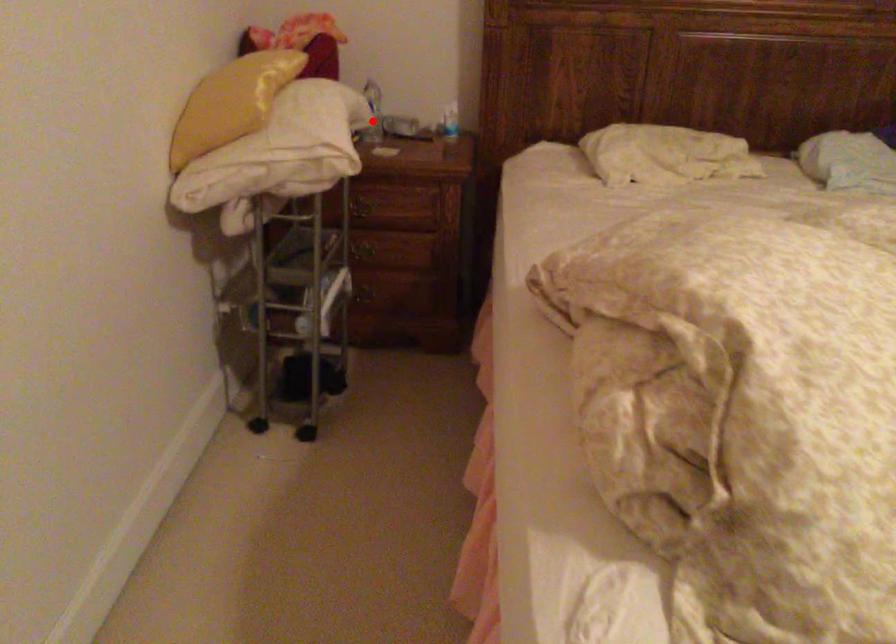
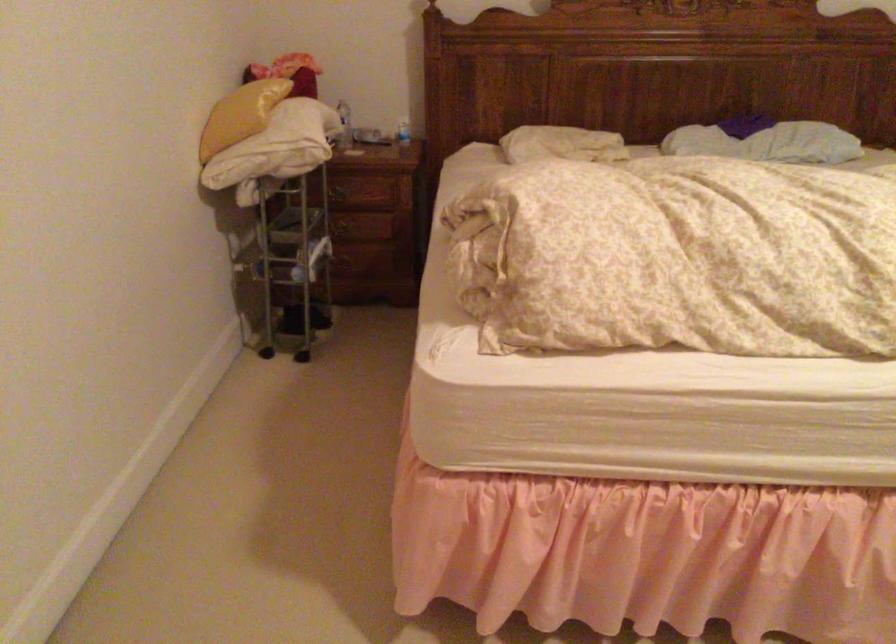
The point at the highlighted location is marked in the first image. Where is the corresponding point in the second image?

(343, 125)